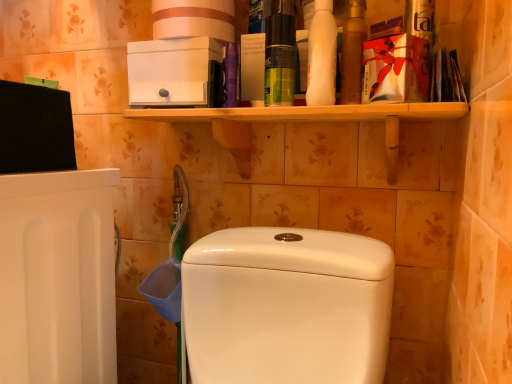
Locate an element on the screen. white glossy toilet at center is located at coordinates (287, 306).

What do you see at coordinates (353, 53) in the screenshot?
I see `gold metallic mouthwash at upper right` at bounding box center [353, 53].

At what (x,y) coordinates should I click in order to perform the action: click on white glossy toilet at center. Please return your answer as a coordinate pair (x, y). This screenshot has height=384, width=512. Looking at the image, I should click on pos(287,306).

Find the location of a particular element. the 2nd cleaning product to the right of the white cardboard toilet paper at upper center, starting your count from the anchor is located at coordinates (322, 56).

Is point (317, 60) less distant than point (222, 39)?

Yes, it is.

Consider the image. From their relative heights in the image, would you say white matte bottle at upper right, the 1th cleaning product when ordered from right to left, is taller or shorter than white cardboard toilet paper at upper center?

Clearly, white matte bottle at upper right, the 1th cleaning product when ordered from right to left, is taller compared to white cardboard toilet paper at upper center.

Who is smaller, white matte bottle at upper right, arranged as the second cleaning product when viewed from the left, or white cardboard toilet paper at upper center?

white matte bottle at upper right, arranged as the second cleaning product when viewed from the left, is smaller.

In the scene shown: Is white glossy toilet at center taller than white matte bottle at upper right, the 1th cleaning product when ordered from right to left?

Correct, white glossy toilet at center is much taller as white matte bottle at upper right, the 1th cleaning product when ordered from right to left.

Could you measure the distance between white glossy toilet at center and white matte bottle at upper right, arranged as the second cleaning product when viewed from the left?

They are 12.96 inches apart.

Considering the sizes of white glossy toilet at center and white matte bottle at upper right, the 1th cleaning product when ordered from right to left, in the image, is white glossy toilet at center bigger or smaller than white matte bottle at upper right, the 1th cleaning product when ordered from right to left,?

Considering their sizes, white glossy toilet at center takes up more space than white matte bottle at upper right, the 1th cleaning product when ordered from right to left.

How many degrees apart are the facing directions of green matte spray can at upper center, which is the first cleaning product in left-to-right order, and white glossy toilet at center?

green matte spray can at upper center, which is the first cleaning product in left-to-right order, and white glossy toilet at center are facing 1.02 degrees away from each other.

Is green matte spray can at upper center, the second cleaning product positioned from the right, with white glossy toilet at center?

No.

Is green matte spray can at upper center, the second cleaning product positioned from the right, in front of or behind white glossy toilet at center in the image?

In the image, green matte spray can at upper center, the second cleaning product positioned from the right, appears behind white glossy toilet at center.

Can green matte spray can at upper center, the second cleaning product positioned from the right, be found inside gold metallic mouthwash at upper right?

Actually, green matte spray can at upper center, the second cleaning product positioned from the right, is outside gold metallic mouthwash at upper right.

Based on the photo, from a real-world perspective, is gold metallic mouthwash at upper right under green matte spray can at upper center, which is the first cleaning product in left-to-right order?

No, from a real-world perspective, gold metallic mouthwash at upper right is not under green matte spray can at upper center, which is the first cleaning product in left-to-right order.

Does gold metallic mouthwash at upper right have a greater height compared to green matte spray can at upper center, which is the first cleaning product in left-to-right order?

Indeed, gold metallic mouthwash at upper right has a greater height compared to green matte spray can at upper center, which is the first cleaning product in left-to-right order.

Is white glossy toilet at center turned away from green matte spray can at upper center, the second cleaning product positioned from the right?

No, white glossy toilet at center is not facing away from green matte spray can at upper center, the second cleaning product positioned from the right.

Based on their sizes in the image, would you say white glossy toilet at center is bigger or smaller than green matte spray can at upper center, the second cleaning product positioned from the right?

white glossy toilet at center is bigger than green matte spray can at upper center, the second cleaning product positioned from the right.

Are white glossy toilet at center and green matte spray can at upper center, which is the first cleaning product in left-to-right order, making contact?

white glossy toilet at center and green matte spray can at upper center, which is the first cleaning product in left-to-right order, are not in contact.

How many degrees apart are the facing directions of white glossy toilet at center and green matte spray can at upper center, the second cleaning product positioned from the right?

There is a 1.02-degree angle between the facing directions of white glossy toilet at center and green matte spray can at upper center, the second cleaning product positioned from the right.

How distant is white cardboard toilet paper at upper center from green matte spray can at upper center, which is the first cleaning product in left-to-right order?

white cardboard toilet paper at upper center is 5.01 inches from green matte spray can at upper center, which is the first cleaning product in left-to-right order.

Is white cardboard toilet paper at upper center bigger than green matte spray can at upper center, the second cleaning product positioned from the right?

Correct, white cardboard toilet paper at upper center is larger in size than green matte spray can at upper center, the second cleaning product positioned from the right.

Are white cardboard toilet paper at upper center and green matte spray can at upper center, the second cleaning product positioned from the right, making contact?

white cardboard toilet paper at upper center is not next to green matte spray can at upper center, the second cleaning product positioned from the right, and they're not touching.

Considering the sizes of white cardboard toilet paper at upper center and green matte spray can at upper center, which is the first cleaning product in left-to-right order, in the image, is white cardboard toilet paper at upper center wider or thinner than green matte spray can at upper center, which is the first cleaning product in left-to-right order,?

Considering their sizes, white cardboard toilet paper at upper center looks broader than green matte spray can at upper center, which is the first cleaning product in left-to-right order.

Which is behind, point (366, 36) or point (217, 27)?

The point (217, 27) is behind.

From the image's perspective, who appears lower, gold metallic mouthwash at upper right or white cardboard toilet paper at upper center?

gold metallic mouthwash at upper right appears lower in the image.

Can you confirm if gold metallic mouthwash at upper right is taller than white cardboard toilet paper at upper center?

Correct, gold metallic mouthwash at upper right is much taller as white cardboard toilet paper at upper center.

Image resolution: width=512 pixels, height=384 pixels. I want to click on the 1st cleaning product directly beneath the white cardboard toilet paper at upper center (from a real-world perspective), so click(322, 56).

This screenshot has width=512, height=384. There is a white glossy toilet at center. In order to click on the 2nd cleaning product above it (from the image's perspective) in this screenshot , I will do `click(322, 56)`.

When comparing their distances from green matte spray can at upper center, which is the first cleaning product in left-to-right order, does gold metallic mouthwash at upper right or white cardboard toilet paper at upper center seem closer?

The object closer to green matte spray can at upper center, which is the first cleaning product in left-to-right order, is gold metallic mouthwash at upper right.

From the image, which object appears to be nearer to white glossy toilet at center, white cardboard toilet paper at upper center or green matte spray can at upper center, the second cleaning product positioned from the right?

green matte spray can at upper center, the second cleaning product positioned from the right, lies closer to white glossy toilet at center than the other object.

Looking at this image, estimate the real-world distances between objects in this image. Which object is further from white cardboard toilet paper at upper center, white matte bottle at upper right, the 1th cleaning product when ordered from right to left, or white glossy toilet at center?

white glossy toilet at center.

Based on their spatial positions, is white glossy toilet at center or white cardboard toilet paper at upper center further from white matte bottle at upper right, the 1th cleaning product when ordered from right to left?

white glossy toilet at center lies further to white matte bottle at upper right, the 1th cleaning product when ordered from right to left, than the other object.

Estimate the real-world distances between objects in this image. Which object is further from green matte spray can at upper center, which is the first cleaning product in left-to-right order, white matte bottle at upper right, arranged as the second cleaning product when viewed from the left, or white cardboard toilet paper at upper center?

white cardboard toilet paper at upper center.

Based on their spatial positions, is gold metallic mouthwash at upper right or white glossy toilet at center closer to white cardboard toilet paper at upper center?

gold metallic mouthwash at upper right.

Based on their spatial positions, is green matte spray can at upper center, the second cleaning product positioned from the right, or gold metallic mouthwash at upper right further from white matte bottle at upper right, the 1th cleaning product when ordered from right to left?

green matte spray can at upper center, the second cleaning product positioned from the right, is further to white matte bottle at upper right, the 1th cleaning product when ordered from right to left.

When comparing their distances from white matte bottle at upper right, the 1th cleaning product when ordered from right to left, does gold metallic mouthwash at upper right or white glossy toilet at center seem further?

white glossy toilet at center is further to white matte bottle at upper right, the 1th cleaning product when ordered from right to left.

Locate an element on the screen. Image resolution: width=512 pixels, height=384 pixels. cleaning product between white matte bottle at upper right, arranged as the second cleaning product when viewed from the left, and white glossy toilet at center from top to bottom is located at coordinates (280, 56).

Locate an element on the screen. Image resolution: width=512 pixels, height=384 pixels. cleaning product between white cardboard toilet paper at upper center and white matte bottle at upper right, arranged as the second cleaning product when viewed from the left, in the horizontal direction is located at coordinates (280, 56).

Image resolution: width=512 pixels, height=384 pixels. I want to click on mouthwash between white cardboard toilet paper at upper center and white glossy toilet at center in the vertical direction, so click(x=353, y=53).

Where is `cleaning product between green matte spray can at upper center, which is the first cleaning product in left-to-right order, and gold metallic mouthwash at upper right`? This screenshot has width=512, height=384. cleaning product between green matte spray can at upper center, which is the first cleaning product in left-to-right order, and gold metallic mouthwash at upper right is located at coordinates (322, 56).